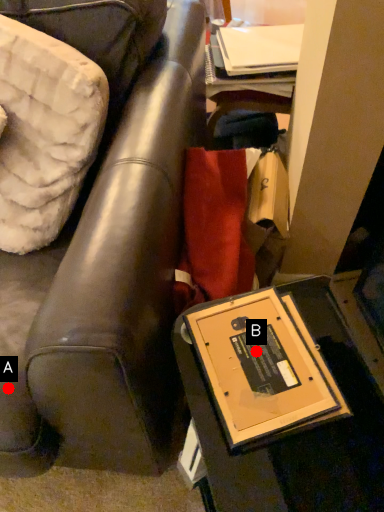
Question: Two points are circled on the image, labeled by A and B beside each circle. Which point is closer to the camera?

Choices:
 (A) A is closer
 (B) B is closer

Answer: (B)